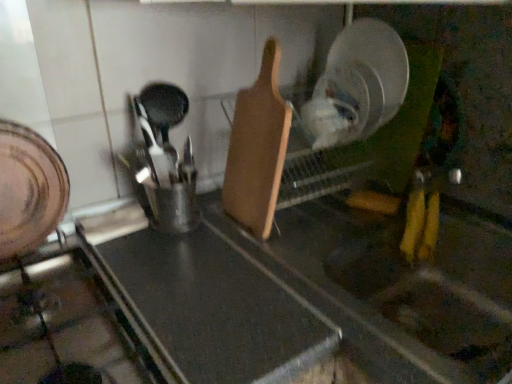
Question: Is brushed metal gas stove at lower left positioned with its back to black matte cutting board at center?

Choices:
 (A) no
 (B) yes

Answer: (A)

Question: From a real-world perspective, is brushed metal gas stove at lower left physically below black matte cutting board at center?

Choices:
 (A) no
 (B) yes

Answer: (A)

Question: Is brushed metal gas stove at lower left positioned beyond the bounds of black matte cutting board at center?

Choices:
 (A) no
 (B) yes

Answer: (B)

Question: Considering the relative sizes of brushed metal gas stove at lower left and black matte cutting board at center in the image provided, is brushed metal gas stove at lower left taller than black matte cutting board at center?

Choices:
 (A) no
 (B) yes

Answer: (A)

Question: Does brushed metal gas stove at lower left lie behind black matte cutting board at center?

Choices:
 (A) yes
 (B) no

Answer: (B)

Question: In terms of size, does wooden cutting board at center appear bigger or smaller than brushed metal gas stove at lower left?

Choices:
 (A) big
 (B) small

Answer: (B)

Question: Which is correct: wooden cutting board at center is inside brushed metal gas stove at lower left, or outside of it?

Choices:
 (A) inside
 (B) outside

Answer: (B)

Question: Considering their positions, is wooden cutting board at center located in front of or behind brushed metal gas stove at lower left?

Choices:
 (A) behind
 (B) front

Answer: (A)

Question: From the image's perspective, is wooden cutting board at center positioned above or below brushed metal gas stove at lower left?

Choices:
 (A) below
 (B) above

Answer: (B)

Question: In the image, is black matte cutting board at center on the left side or the right side of brushed metal gas stove at lower left?

Choices:
 (A) left
 (B) right

Answer: (B)

Question: From the image's perspective, is black matte cutting board at center located above or below brushed metal gas stove at lower left?

Choices:
 (A) below
 (B) above

Answer: (A)

Question: Is black matte cutting board at center inside the boundaries of brushed metal gas stove at lower left, or outside?

Choices:
 (A) outside
 (B) inside

Answer: (A)

Question: Based on their sizes in the image, would you say black matte cutting board at center is bigger or smaller than brushed metal gas stove at lower left?

Choices:
 (A) small
 (B) big

Answer: (B)

Question: Does point click(298, 306) appear closer or farther from the camera than point click(241, 183)?

Choices:
 (A) closer
 (B) farther

Answer: (A)

Question: From the image's perspective, relative to wooden cutting board at center, is black matte cutting board at center above or below?

Choices:
 (A) above
 (B) below

Answer: (B)